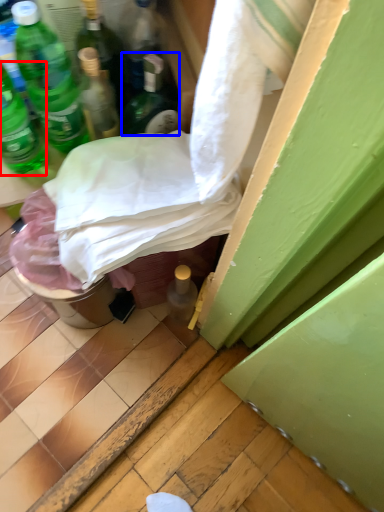
Question: Among these objects, which one is farthest to the camera, bottle (highlighted by a red box) or bottle (highlighted by a blue box)?

Choices:
 (A) bottle
 (B) bottle

Answer: (B)